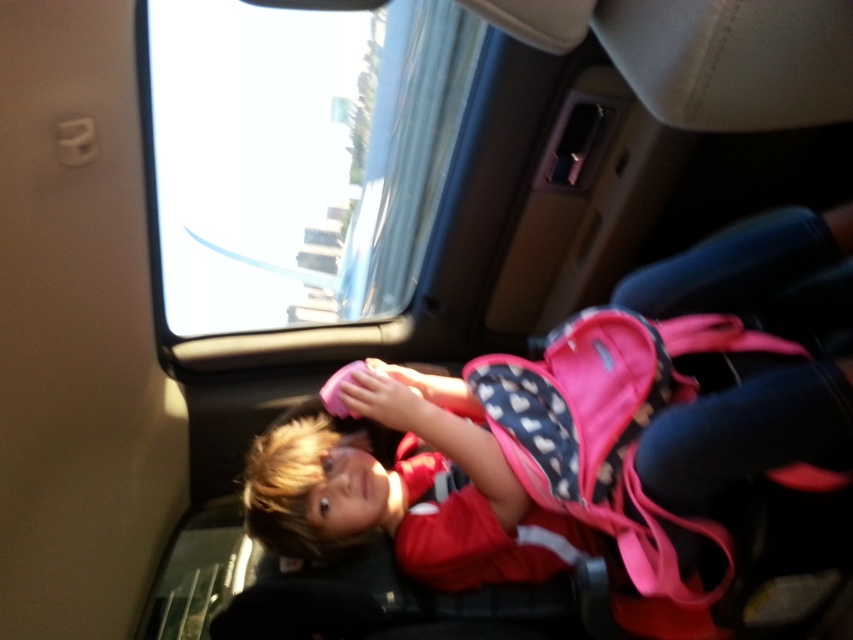
Measure the distance between point (265, 284) and camera.

Point (265, 284) is 7.36 feet away from camera.

Is point (337, 195) positioned before point (323, 451)?

No.

Does point (248, 141) come in front of point (270, 451)?

No, (248, 141) is behind (270, 451).

Locate an element on the screen. transparent glass window at upper center is located at coordinates (299, 156).